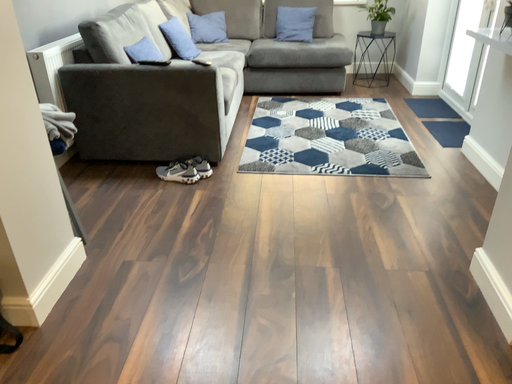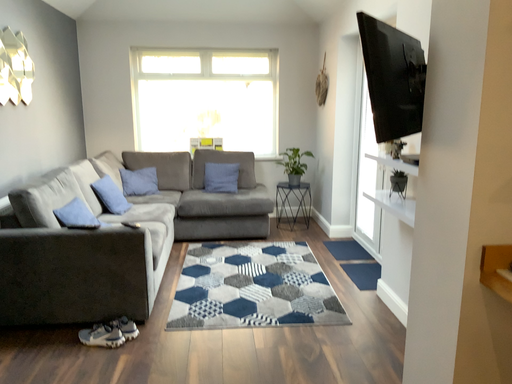
Question: Which way did the camera rotate in the video?

Choices:
 (A) rotated left
 (B) rotated right

Answer: (B)